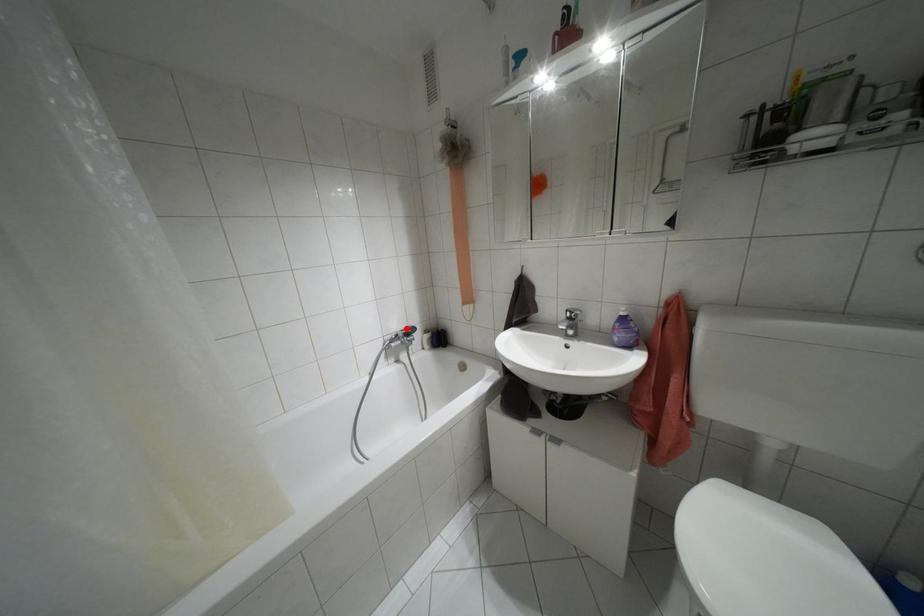
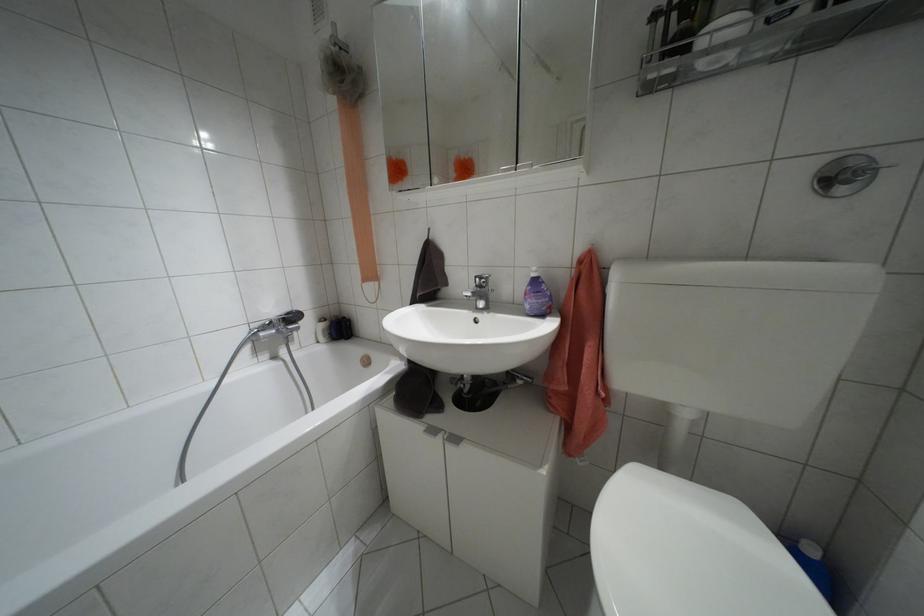
Question: I am providing you with two images of the same scene from different viewpoints. Image1 has a red point marked. In image2, the corresponding 3D location appears at what relative position? Reply with the corresponding letter.

Choices:
 (A) Closer
 (B) Farther

Answer: (A)